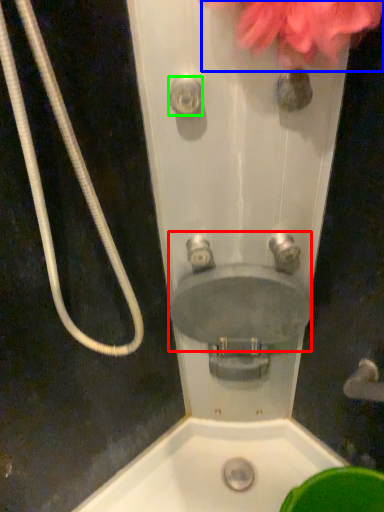
Question: Based on their relative distances, which object is nearer to sink (highlighted by a red box)? Choose from flower (highlighted by a blue box) and shower (highlighted by a green box).

Choices:
 (A) flower
 (B) shower

Answer: (B)